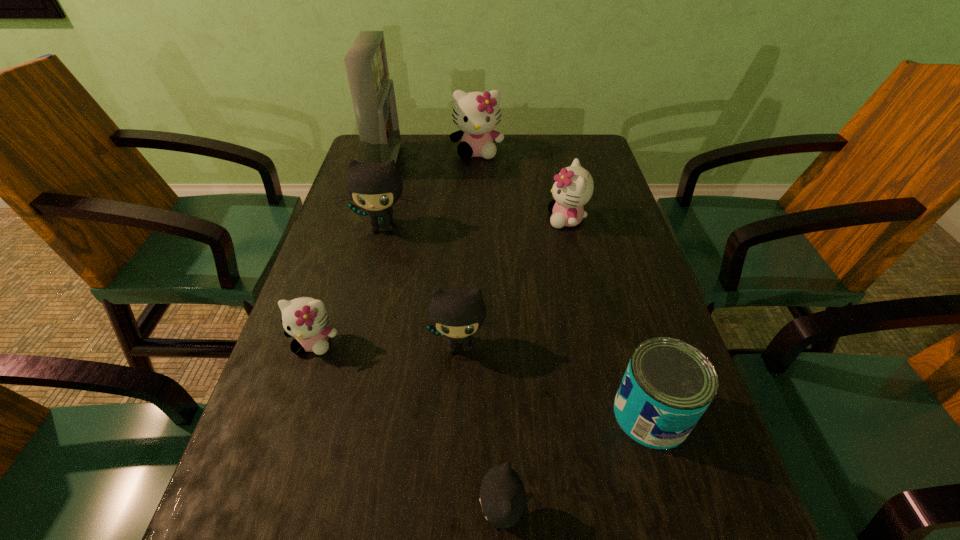
Locate an element on the screen. Image resolution: width=960 pixels, height=540 pixels. the third closest kitten to the blue can is located at coordinates (573, 188).

Locate which kitten ranks second in proximity to the first-aid kit. Please provide its 2D coordinates. Your answer should be formatted as a tuple, i.e. [(x, y)], where the tuple contains the x and y coordinates of a point satisfying the conditions above.

[(374, 186)]

Where is `white kitten that is the third closest to the second nearest gray kitten`? white kitten that is the third closest to the second nearest gray kitten is located at coordinates (476, 114).

Find the location of a particular element. The height and width of the screenshot is (540, 960). the closest white kitten to the smallest white kitten is located at coordinates (573, 188).

Identify the location of the third closest gray kitten relative to the red first-aid kit. (502, 496).

Identify the location of gray kitten that is the third closest one to the nearest white kitten. This screenshot has height=540, width=960. (502, 496).

You are a GUI agent. You are given a task and a screenshot of the screen. Output one action in this format:
    pyautogui.click(x=<x>, y=<y>)
    Task: Click on the vacant space that satisfies the following two spatial constraints: 1. on the front-facing side of the blue can; 2. on the left side of the biggest gray kitten
    
    Given the screenshot: What is the action you would take?
    pyautogui.click(x=336, y=414)

Locate an element on the screen. The width and height of the screenshot is (960, 540). vacant space that satisfies the following two spatial constraints: 1. on the front-facing side of the red first-aid kit; 2. on the front-facing side of the smallest white kitten is located at coordinates (333, 342).

Image resolution: width=960 pixels, height=540 pixels. I want to click on vacant point that satisfies the following two spatial constraints: 1. on the front-facing side of the red first-aid kit; 2. on the right side of the blue can, so click(313, 414).

The width and height of the screenshot is (960, 540). What are the coordinates of `blank space that satisfies the following two spatial constraints: 1. on the front-facing side of the first-aid kit; 2. on the front-facing side of the leftmost white kitten` in the screenshot? It's located at (333, 342).